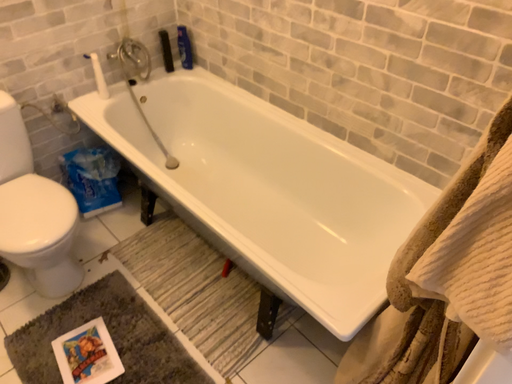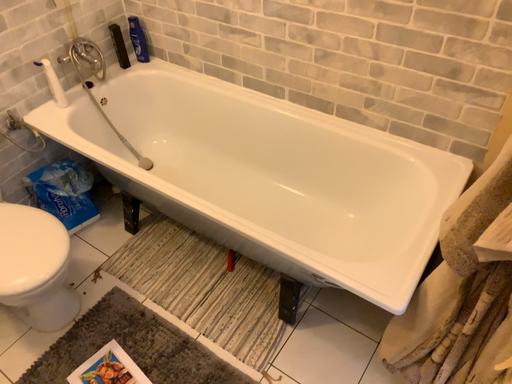
Question: How did the camera likely rotate when shooting the video?

Choices:
 (A) rotated left
 (B) rotated right

Answer: (B)